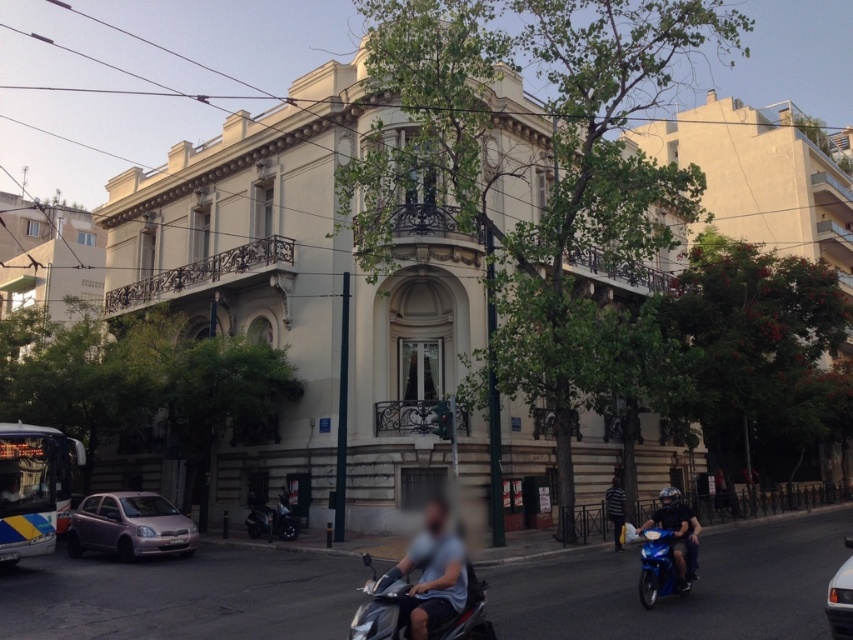
I want to click on silver metallic scooter at center, so click(383, 605).

Does silver metallic scooter at center appear on the left side of blue metallic scooter at lower right?

Correct, you'll find silver metallic scooter at center to the left of blue metallic scooter at lower right.

This screenshot has height=640, width=853. Describe the element at coordinates (383, 605) in the screenshot. I see `silver metallic scooter at center` at that location.

Where is `silver metallic scooter at center`? The image size is (853, 640). silver metallic scooter at center is located at coordinates click(x=383, y=605).

Can you confirm if blue metallic scooter at lower right is positioned to the left of striped shirt at center?

Incorrect, blue metallic scooter at lower right is not on the left side of striped shirt at center.

From the picture: Can you confirm if blue metallic scooter at lower right is positioned below striped shirt at center?

No.

Is point (660, 508) less distant than point (618, 545)?

Yes.

Locate an element on the screen. Image resolution: width=853 pixels, height=640 pixels. blue metallic scooter at lower right is located at coordinates (672, 525).

Which is behind, point (405, 557) or point (397, 616)?

Positioned behind is point (405, 557).

Which of these two, gray fabric shirt at lower center or silver metallic scooter at center, stands taller?

Standing taller between the two is gray fabric shirt at lower center.

At what (x,y) coordinates should I click in order to perform the action: click on gray fabric shirt at lower center. Please return your answer as a coordinate pair (x, y). Looking at the image, I should click on (428, 577).